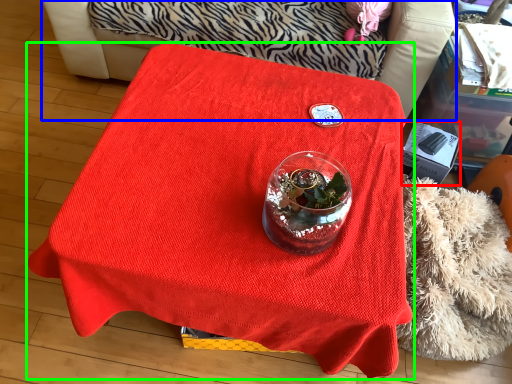
Question: Considering the real-world distances, which object is farthest from box (highlighted by a red box)? furniture (highlighted by a blue box) or table (highlighted by a green box)?

Choices:
 (A) furniture
 (B) table

Answer: (A)